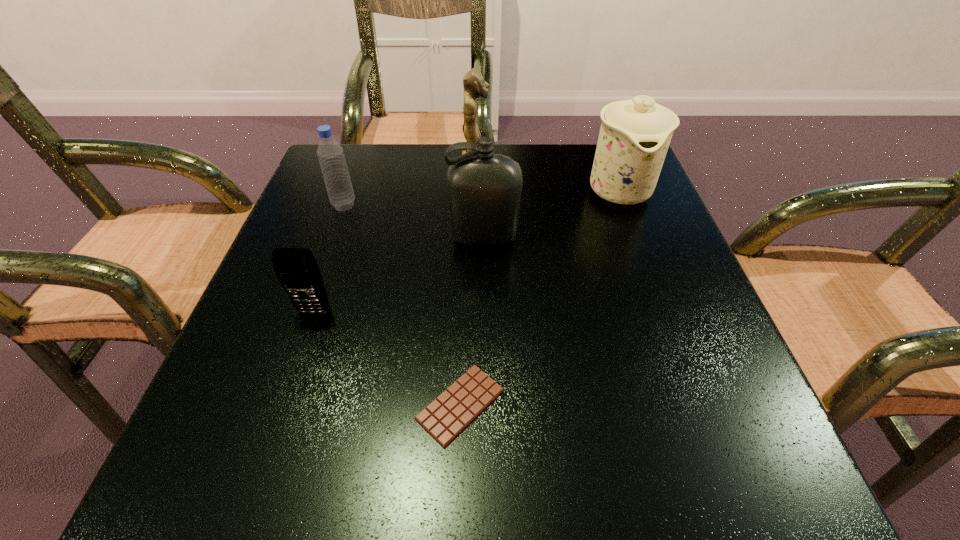
Identify the location of bottle that is positioned at the left edge. (331, 157).

You are a GUI agent. You are given a task and a screenshot of the screen. Output one action in this format:
    pyautogui.click(x=<x>, y=<y>)
    Task: Click on the cellular telephone at the left edge
    The image size is (960, 540).
    Given the screenshot: What is the action you would take?
    pyautogui.click(x=296, y=269)

At what (x,y) coordinates should I click in order to perform the action: click on object located in the right edge section of the desktop. Please return your answer as a coordinate pair (x, y). This screenshot has height=540, width=960. Looking at the image, I should click on (635, 134).

Find the location of a particular element. Image resolution: width=960 pixels, height=540 pixels. object located in the far left corner section of the desktop is located at coordinates (331, 157).

Locate an element on the screen. The height and width of the screenshot is (540, 960). object located in the far right corner section of the desktop is located at coordinates (635, 134).

Image resolution: width=960 pixels, height=540 pixels. In order to click on blank area at the far edge in this screenshot , I will do `click(397, 153)`.

Locate an element on the screen. The width and height of the screenshot is (960, 540). vacant space at the near edge is located at coordinates (447, 489).

Find the location of a particular element. vacant space at the left edge of the desktop is located at coordinates (301, 210).

Where is `vacant area at the right edge of the desktop`? The height and width of the screenshot is (540, 960). vacant area at the right edge of the desktop is located at coordinates (650, 293).

In the image, there is a desktop. At what (x,y) coordinates should I click in order to perform the action: click on vacant space at the far left corner. Please return your answer as a coordinate pair (x, y). This screenshot has height=540, width=960. Looking at the image, I should click on (350, 168).